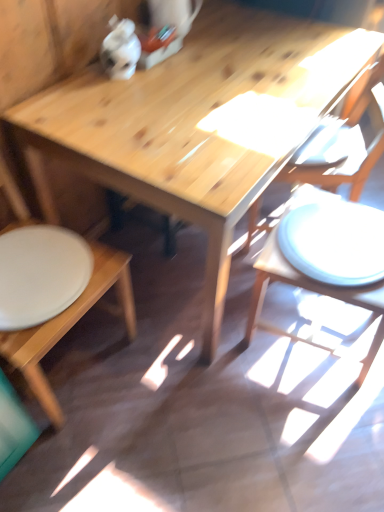
Question: Considering their positions, is wooden table at center located in front of or behind wooden chair at right, placed as the first chair when sorted from right to left?

Choices:
 (A) behind
 (B) front

Answer: (B)

Question: Considering the positions of wooden table at center and wooden chair at right, placed as the first chair when sorted from right to left, in the image, is wooden table at center wider or thinner than wooden chair at right, placed as the first chair when sorted from right to left,?

Choices:
 (A) thin
 (B) wide

Answer: (B)

Question: Estimate the real-world distances between objects in this image. Which object is farther from the wooden table at center?

Choices:
 (A) wooden chair at right, placed as the first chair when sorted from right to left
 (B) wooden chair at lower left, which is the 2th chair from right to left
 (C) white matte plate at lower left

Answer: (B)

Question: Estimate the real-world distances between objects in this image. Which object is farther from the wooden table at center?

Choices:
 (A) wooden chair at lower left, positioned as the first chair in left-to-right order
 (B) wooden chair at right, placed as the first chair when sorted from right to left
 (C) white matte plate at lower left

Answer: (A)